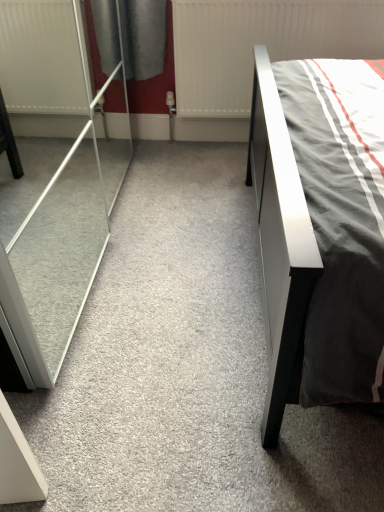
Describe the element at coordinates (260, 44) in the screenshot. The height and width of the screenshot is (512, 384). I see `white textured radiator at upper center` at that location.

I want to click on white textured radiator at upper center, so click(260, 44).

What do you see at coordinates (53, 180) in the screenshot?
I see `transparent glass screen door at left` at bounding box center [53, 180].

Measure the distance between transparent glass screen door at left and camera.

They are 38.36 inches apart.

The width and height of the screenshot is (384, 512). Identify the location of transparent glass screen door at left. [53, 180].

Identify the location of white textured radiator at upper center. (260, 44).

Considering the positions of objects white textured radiator at upper center and transparent glass screen door at left in the image provided, who is more to the left, white textured radiator at upper center or transparent glass screen door at left?

Positioned to the left is transparent glass screen door at left.

Considering their positions, is white textured radiator at upper center located in front of or behind transparent glass screen door at left?

white textured radiator at upper center is positioned farther from the viewer than transparent glass screen door at left.

Is point (231, 7) in front of point (57, 376)?

No, it is behind (57, 376).

From the image's perspective, would you say white textured radiator at upper center is shown under transparent glass screen door at left?

No.

From a real-world perspective, who is located lower, white textured radiator at upper center or transparent glass screen door at left?

white textured radiator at upper center.

Between white textured radiator at upper center and transparent glass screen door at left, which one has smaller width?

Thinner between the two is white textured radiator at upper center.

Which of these two, white textured radiator at upper center or transparent glass screen door at left, stands taller?

transparent glass screen door at left.

Can you confirm if white textured radiator at upper center is bigger than transparent glass screen door at left?

Actually, white textured radiator at upper center might be smaller than transparent glass screen door at left.

Is white textured radiator at upper center situated inside transparent glass screen door at left or outside?

The correct answer is: outside.

Is white textured radiator at upper center positioned far away from transparent glass screen door at left?

Actually, white textured radiator at upper center and transparent glass screen door at left are a little close together.

Is white textured radiator at upper center oriented towards transparent glass screen door at left?

Yes, white textured radiator at upper center is turned towards transparent glass screen door at left.

Can you tell me how much white textured radiator at upper center and transparent glass screen door at left differ in facing direction?

90.3 degrees separate the facing orientations of white textured radiator at upper center and transparent glass screen door at left.

Image resolution: width=384 pixels, height=512 pixels. What are the coordinates of `radiator below the transparent glass screen door at left (from a real-world perspective)` in the screenshot? It's located at (260, 44).

Consider the image. Is transparent glass screen door at left to the right of white textured radiator at upper center from the viewer's perspective?

No.

Is transparent glass screen door at left closer to camera compared to white textured radiator at upper center?

Yes, transparent glass screen door at left is closer to the viewer.

Does point (62, 289) come farther from viewer compared to point (314, 34)?

No, (62, 289) is closer to viewer.

From the image's perspective, which object appears higher, transparent glass screen door at left or white textured radiator at upper center?

white textured radiator at upper center is shown above in the image.

From a real-world perspective, which is physically below, transparent glass screen door at left or white textured radiator at upper center?

white textured radiator at upper center, from a real-world perspective.

In terms of width, does transparent glass screen door at left look wider or thinner when compared to white textured radiator at upper center?

Considering their sizes, transparent glass screen door at left looks broader than white textured radiator at upper center.

Considering the relative sizes of transparent glass screen door at left and white textured radiator at upper center in the image provided, is transparent glass screen door at left taller than white textured radiator at upper center?

Indeed, transparent glass screen door at left has a greater height compared to white textured radiator at upper center.

Does transparent glass screen door at left have a larger size compared to white textured radiator at upper center?

Yes.

Would you say transparent glass screen door at left contains white textured radiator at upper center?

No, white textured radiator at upper center is located outside of transparent glass screen door at left.

Is transparent glass screen door at left in contact with white textured radiator at upper center?

There is a gap between transparent glass screen door at left and white textured radiator at upper center.

Could you tell me if transparent glass screen door at left is facing white textured radiator at upper center?

Yes, transparent glass screen door at left is facing white textured radiator at upper center.

How different are the orientations of transparent glass screen door at left and white textured radiator at upper center in degrees?

The angle between the facing direction of transparent glass screen door at left and the facing direction of white textured radiator at upper center is 90.3 degrees.

The height and width of the screenshot is (512, 384). Find the location of `radiator that is on the right side of transparent glass screen door at left`. radiator that is on the right side of transparent glass screen door at left is located at coordinates (260, 44).

Locate an element on the screen. screen door below the white textured radiator at upper center (from the image's perspective) is located at coordinates coord(53,180).

The width and height of the screenshot is (384, 512). I want to click on screen door above the white textured radiator at upper center (from a real-world perspective), so click(53, 180).